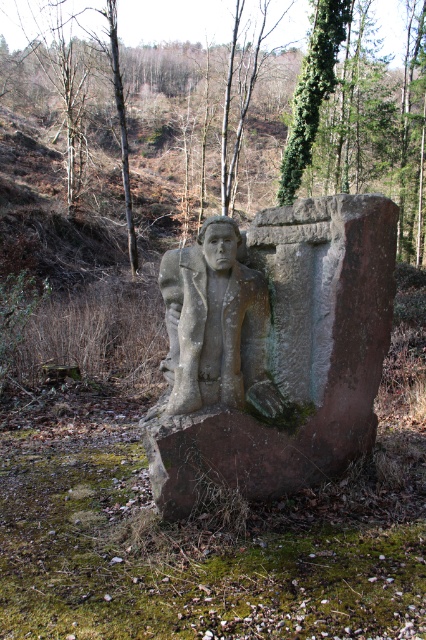
Question: Which point is farther to the camera?

Choices:
 (A) (233, 260)
 (B) (293, 100)

Answer: (B)

Question: Is stone statue at center to the right of gray stone statue at center from the viewer's perspective?

Choices:
 (A) no
 (B) yes

Answer: (B)

Question: Which of the following is the closest to the observer?

Choices:
 (A) gray stone statue at center
 (B) stone statue at center
 (C) green mossy tree at upper center
 (D) green mossy tree at center

Answer: (B)

Question: Among these points, which one is farthest from the camera?

Choices:
 (A) (233, 355)
 (B) (294, 288)
 (C) (331, 83)

Answer: (C)

Question: From the image, what is the correct spatial relationship of gray stone statue at center in relation to green mossy tree at upper center?

Choices:
 (A) above
 (B) below

Answer: (B)

Question: Can you confirm if green mossy tree at center is positioned above stone statue at center?

Choices:
 (A) yes
 (B) no

Answer: (A)